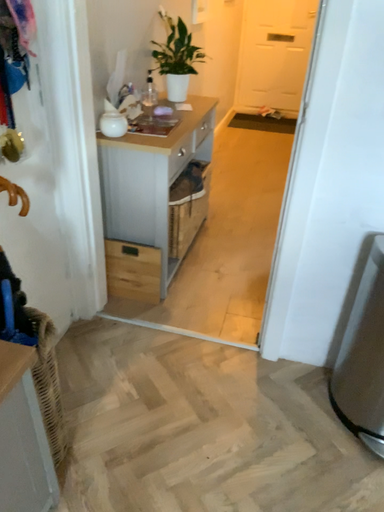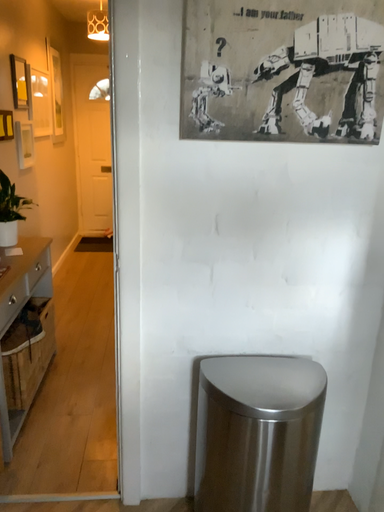
Question: How did the camera likely rotate when shooting the video?

Choices:
 (A) rotated upward
 (B) rotated downward

Answer: (A)